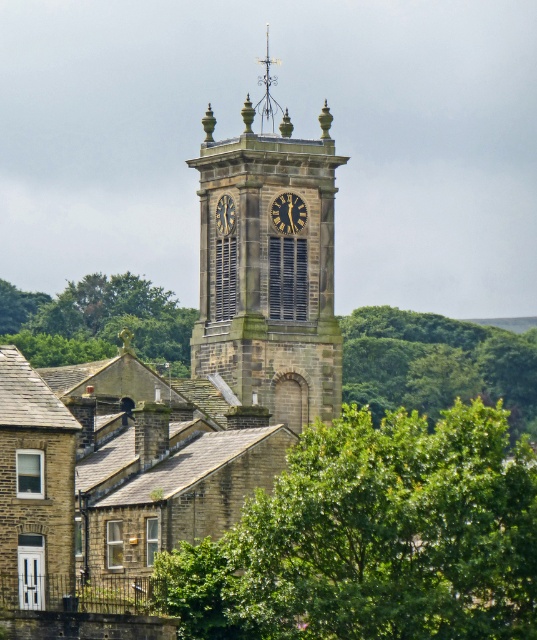
Question: Can you confirm if stone clock tower at center is positioned to the left of green leafy tree at center?

Choices:
 (A) yes
 (B) no

Answer: (A)

Question: Which of these objects is positioned closest to the green leafy tree at left?

Choices:
 (A) green leafy tree at center
 (B) stone clock tower at center
 (C) dark gray stone clock at center

Answer: (A)

Question: Which object is closer to the camera taking this photo?

Choices:
 (A) green leafy tree at center
 (B) dark gray stone clock at center
 (C) green leafy tree at lower center
 (D) stone clock tower at center

Answer: (C)

Question: Can you confirm if green leafy tree at center is thinner than gold metallic clock at center?

Choices:
 (A) no
 (B) yes

Answer: (A)

Question: Based on their relative distances, which object is farther from the green leafy tree at left?

Choices:
 (A) green leafy tree at center
 (B) gold metallic clock at center
 (C) stone clock tower at center
 (D) dark gray stone clock at center

Answer: (B)

Question: Is green leafy tree at center positioned behind dark gray stone clock at center?

Choices:
 (A) yes
 (B) no

Answer: (A)